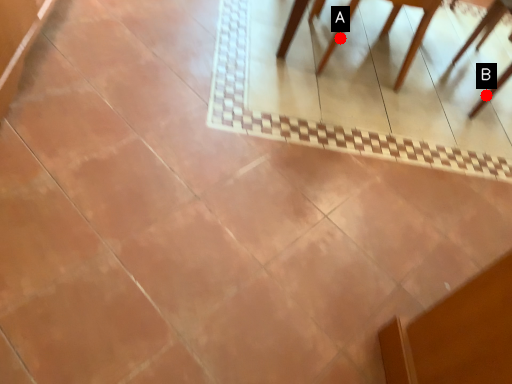
Question: Two points are circled on the image, labeled by A and B beside each circle. Which point is closer to the camera?

Choices:
 (A) A is closer
 (B) B is closer

Answer: (B)